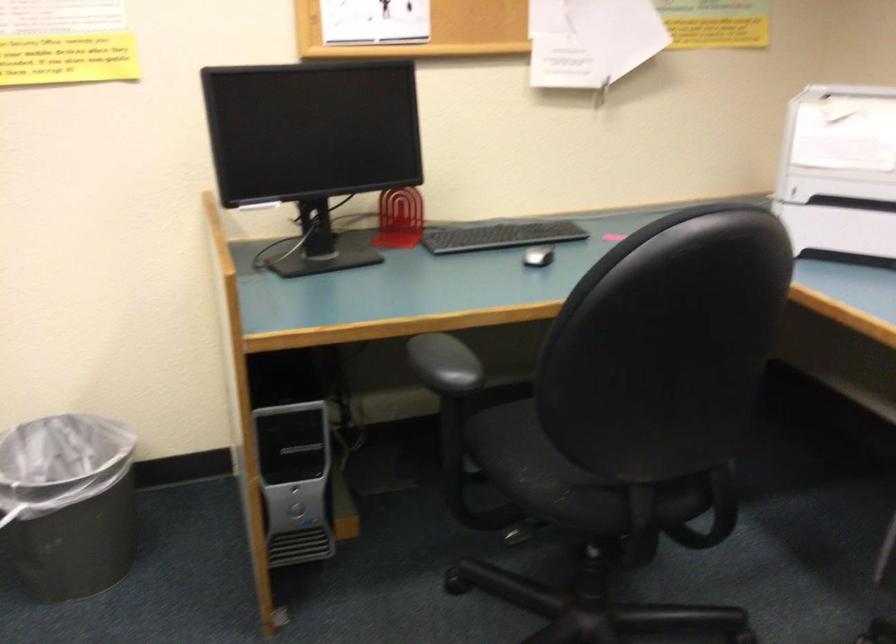
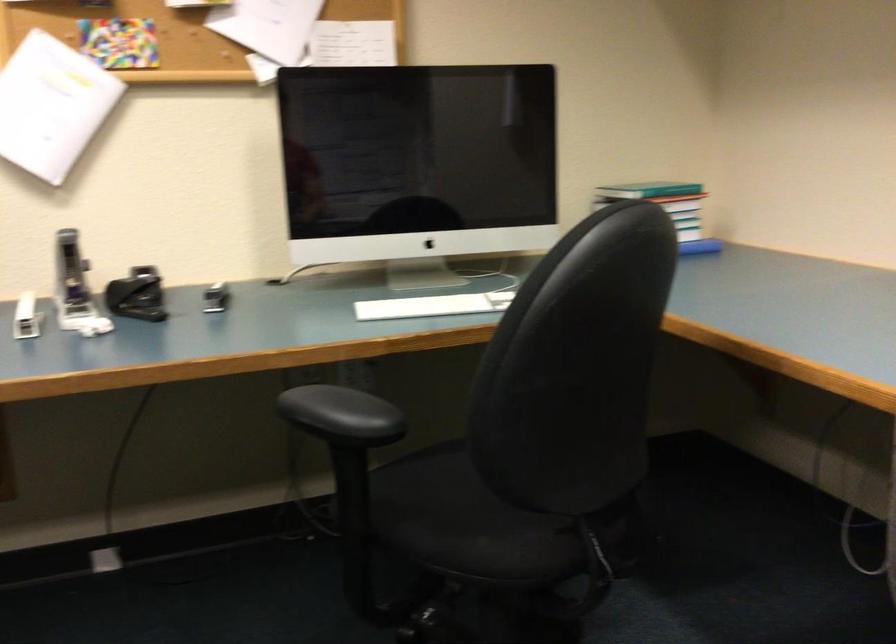
Question: The images are taken continuously from a first-person perspective. In which direction is your viewpoint rotating?

Choices:
 (A) Left
 (B) Right
 (C) Up
 (D) Down

Answer: (B)